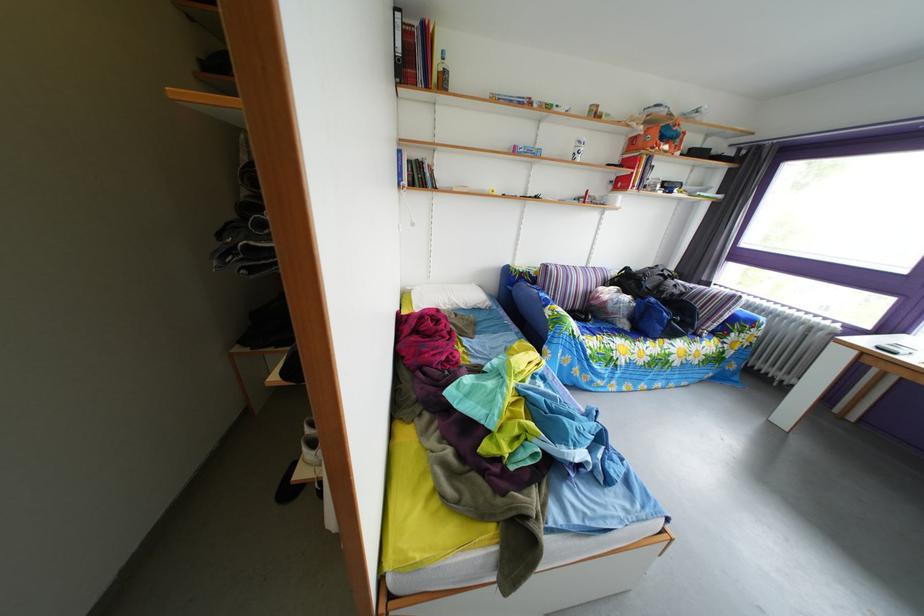
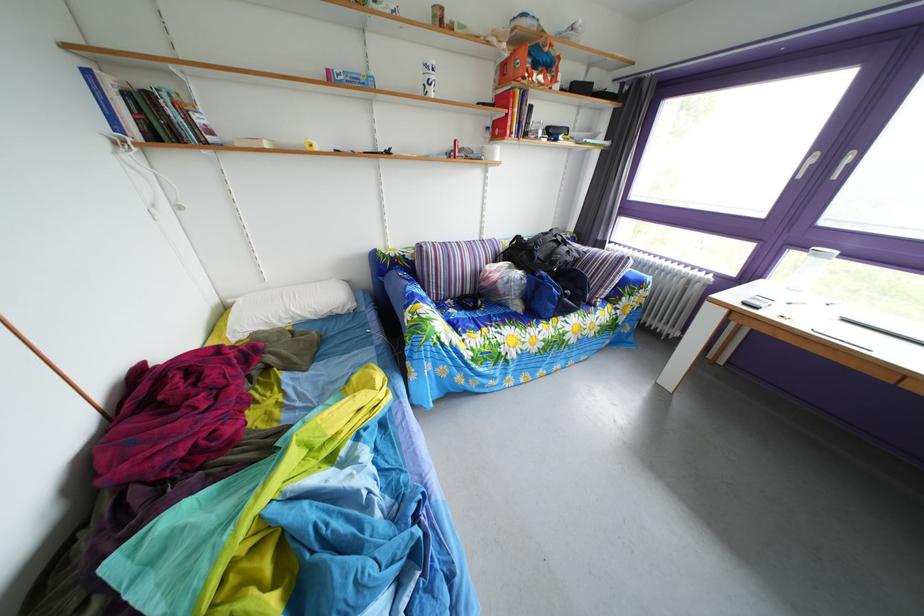
The point at [585,152] is marked in the first image. Where is the corresponding point in the second image?

(432, 79)